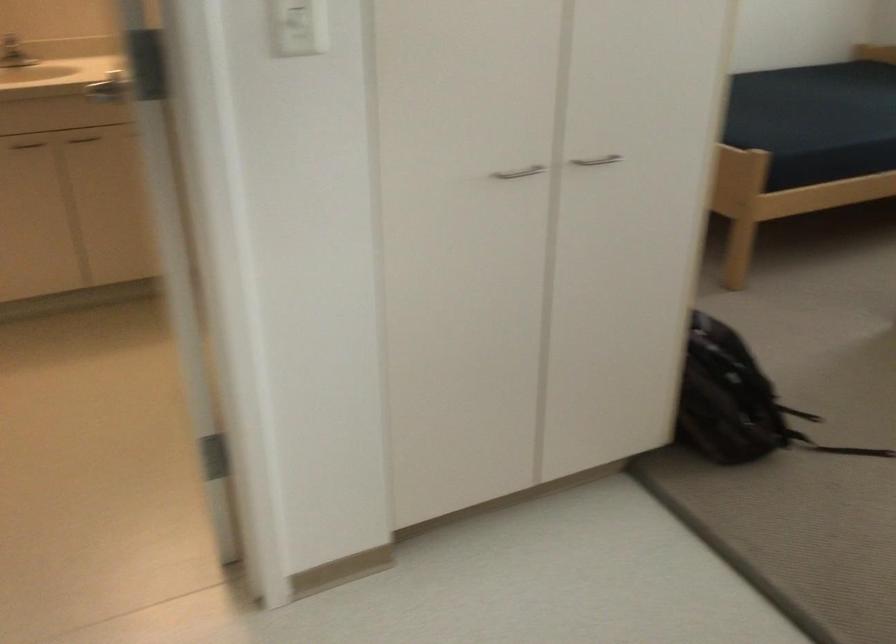
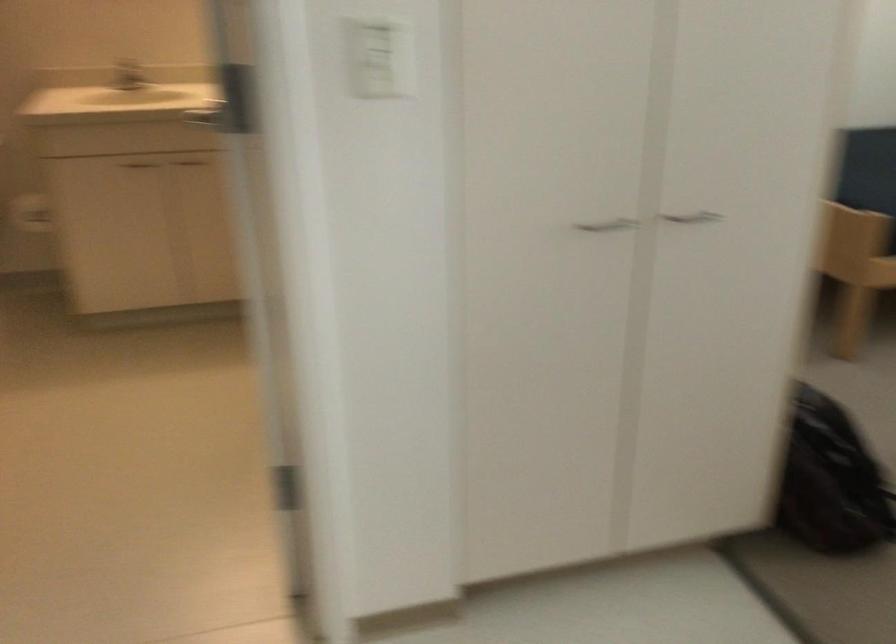
The images are taken continuously from a first-person perspective. In which direction are you moving?

The cameraman moved toward right, forward.